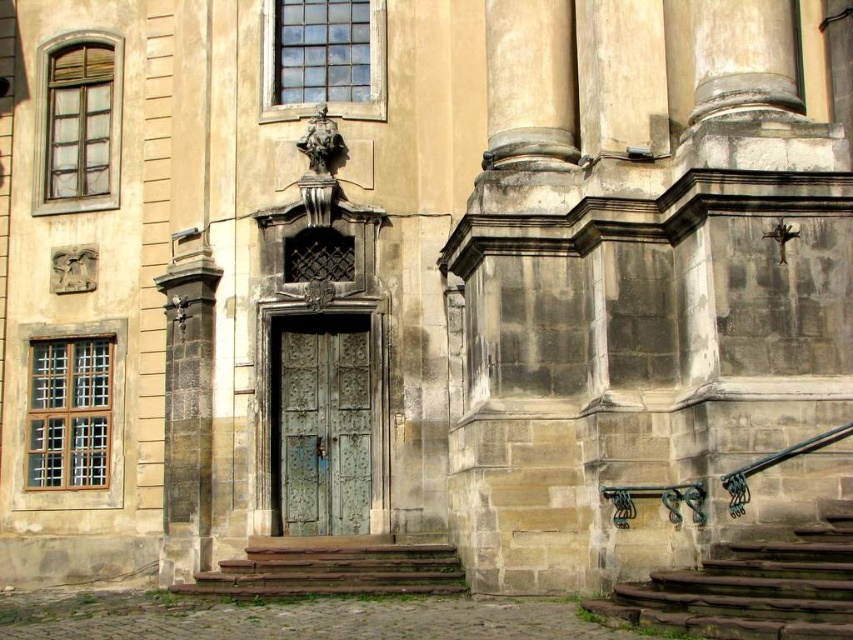
You are a painter who needs to decide which object to paint first between the green patina metal door at center and the brown stone stairs at lower center. Since you want to start with the wider object, which one should you choose?

The brown stone stairs at lower center is wider than the green patina metal door at center, so you should start painting the brown stone stairs at lower center first.

You are standing at the base of the green stone stairs at lower right and want to reach the green patina metal door at center. Which direction should you move to get closer to the door?

To reach the green patina metal door at center from the green stone stairs at lower right, you should move upward since the stairs are positioned under the door.

You are standing at the base of the brown stone stairs at lower center and want to enter the green patina metal door at center. Which direction should you move towards?

You should move towards the right since the green patina metal door at center is to the right of the brown stone stairs at lower center.